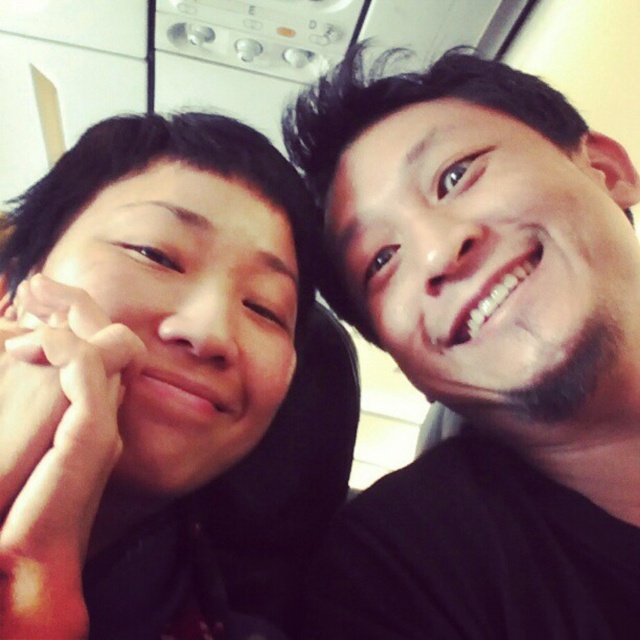
Question: Can you confirm if smooth skin face at right is positioned to the right of matte skin face at left?

Choices:
 (A) no
 (B) yes

Answer: (B)

Question: Based on their relative distances, which object is nearer to the matte skin face at left?

Choices:
 (A) black matte hair at upper right
 (B) smooth skin face at right
 (C) matte black hair at left

Answer: (C)

Question: Does black matte hair at upper right appear over matte black hair at left?

Choices:
 (A) no
 (B) yes

Answer: (B)

Question: Does matte black hair at left appear over smooth skin face at right?

Choices:
 (A) no
 (B) yes

Answer: (A)

Question: Which point is farther to the camera?

Choices:
 (A) (348, 605)
 (B) (440, 253)
 (C) (193, 250)
 (D) (333, 406)

Answer: (D)

Question: Based on their relative distances, which object is farther from the matte skin face at left?

Choices:
 (A) matte black hair at left
 (B) smooth skin face at right

Answer: (B)